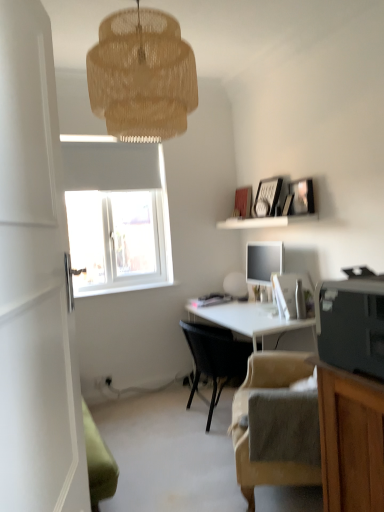
Question: From their relative heights in the image, would you say white glossy desk at center is taller or shorter than beige fabric chair at lower right, the second chair from the back?

Choices:
 (A) short
 (B) tall

Answer: (B)

Question: Considering the positions of white glossy desk at center and beige fabric chair at lower right, which is the 1th chair in front-to-back order, in the image, is white glossy desk at center wider or thinner than beige fabric chair at lower right, which is the 1th chair in front-to-back order,?

Choices:
 (A) thin
 (B) wide

Answer: (B)

Question: Which object is positioned closest to the white glossy desk at center?

Choices:
 (A) white glossy door at left
 (B) black woven chair at center, the second chair positioned from the front
 (C) woven beige lampshade at upper center
 (D) black plastic printer at lower right
 (E) beige fabric chair at lower right, the second chair from the back

Answer: (B)

Question: Which object is the farthest from the white glossy door at left?

Choices:
 (A) white matte shelf at upper center
 (B) woven beige lampshade at upper center
 (C) black plastic printer at lower right
 (D) black woven chair at center, the 1th chair in the back-to-front sequence
 (E) beige fabric chair at lower right, which is the 1th chair in front-to-back order

Answer: (A)